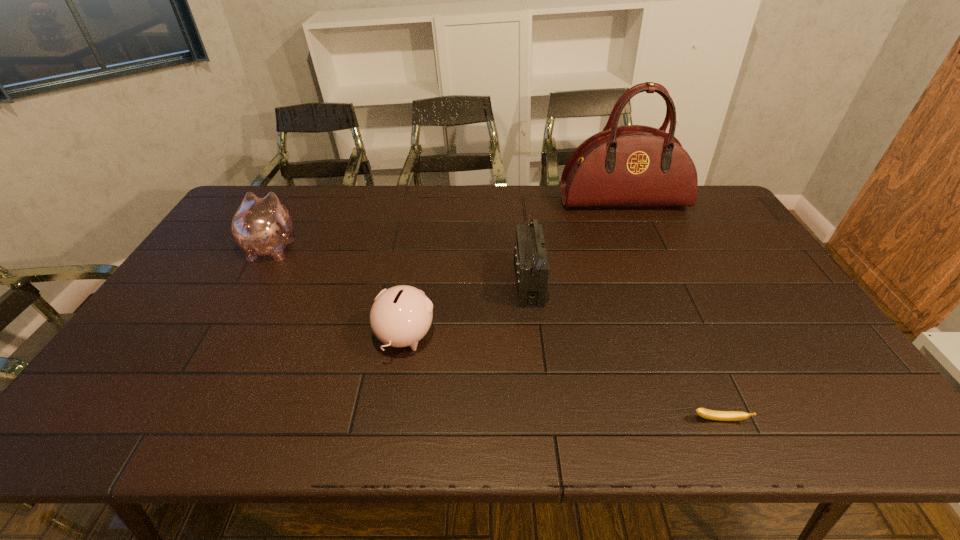
Where is `free region located 0.180m on the front-facing side of the farthest object`? The height and width of the screenshot is (540, 960). free region located 0.180m on the front-facing side of the farthest object is located at coordinates (642, 246).

Find the location of a particular element. This screenshot has width=960, height=540. vacant space located on the front panel of the second tallest object is located at coordinates (406, 284).

In order to click on vacant space located 0.100m on the front panel of the second tallest object in this screenshot , I will do `click(481, 284)`.

I want to click on vacant space situated on the front panel of the second tallest object, so click(413, 284).

Locate an element on the screen. The image size is (960, 540). free space located 0.230m on the front facing side of the taller piggy bank is located at coordinates (302, 194).

Locate an element on the screen. free space located 0.050m on the front facing side of the taller piggy bank is located at coordinates (287, 221).

At what (x,y) coordinates should I click in order to perform the action: click on free spot located on the front facing side of the taller piggy bank. Please return your answer as a coordinate pair (x, y). This screenshot has width=960, height=540. Looking at the image, I should click on (290, 216).

You are a GUI agent. You are given a task and a screenshot of the screen. Output one action in this format:
    pyautogui.click(x=<x>, y=<y>)
    Task: Click on the vacant space positioned on the left of the nearer piggy bank
    The width and height of the screenshot is (960, 540).
    Given the screenshot: What is the action you would take?
    pyautogui.click(x=298, y=337)

Locate an element on the screen. object located at the far edge is located at coordinates (634, 165).

Identify the location of object present at the near edge. (702, 412).